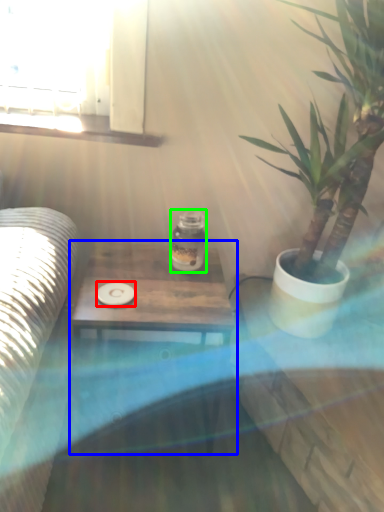
Question: Based on their relative distances, which object is nearer to coaster (highlighted by a red box)? Choose from table (highlighted by a blue box) and glass jar (highlighted by a green box).

Choices:
 (A) table
 (B) glass jar

Answer: (A)